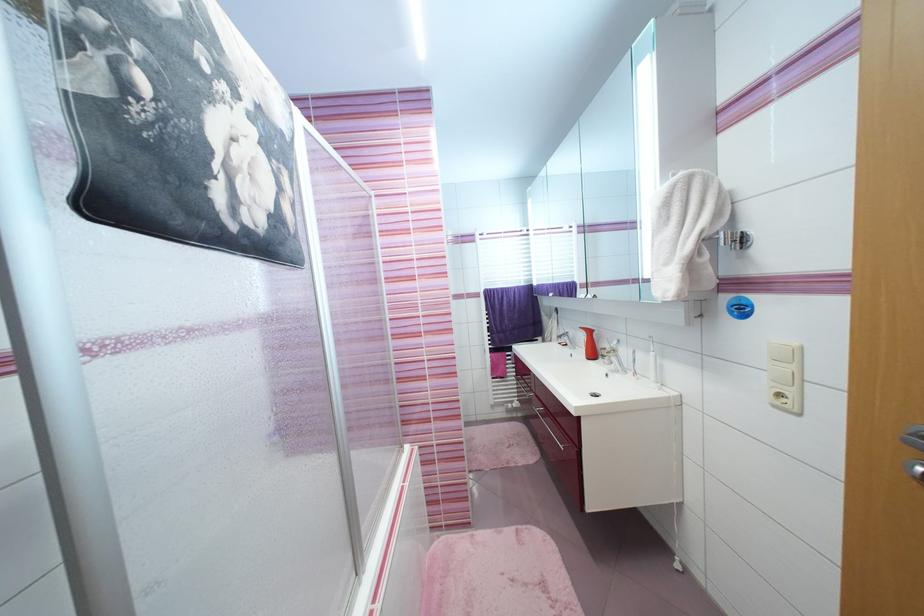
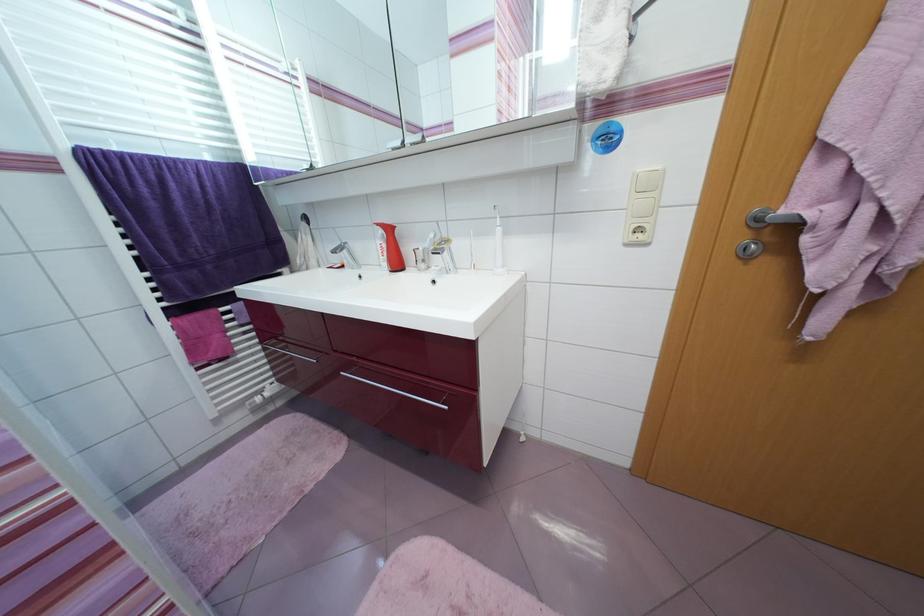
Question: How did the camera likely rotate?

Choices:
 (A) Left
 (B) Right
 (C) Up
 (D) Down

Answer: (B)